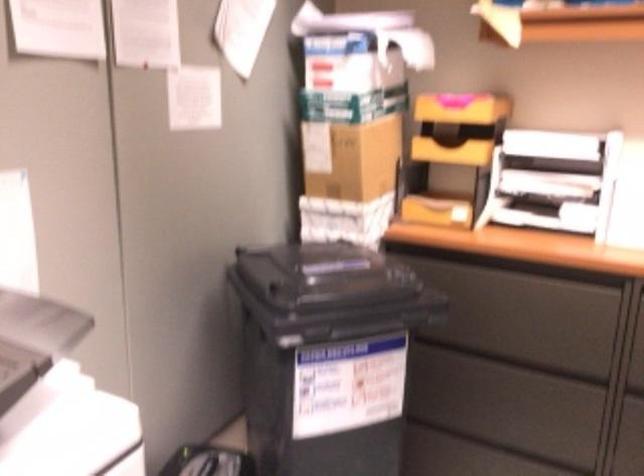
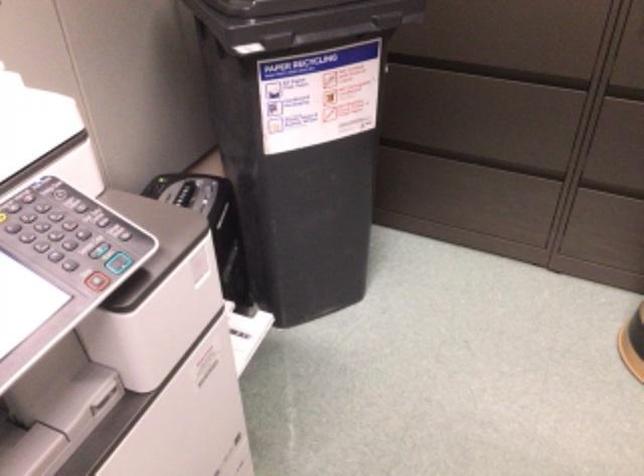
The point at (337, 322) is marked in the first image. Where is the corresponding point in the second image?

(298, 21)